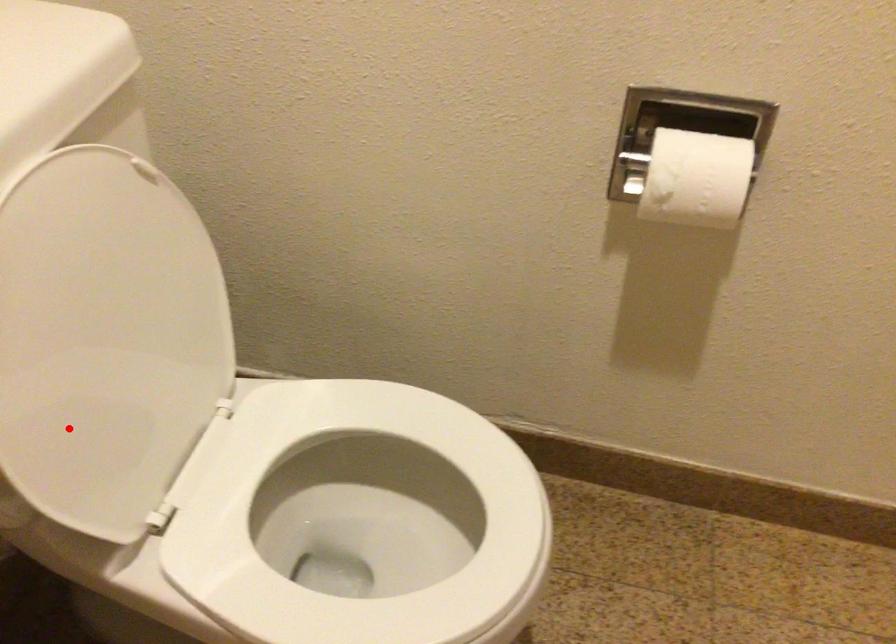
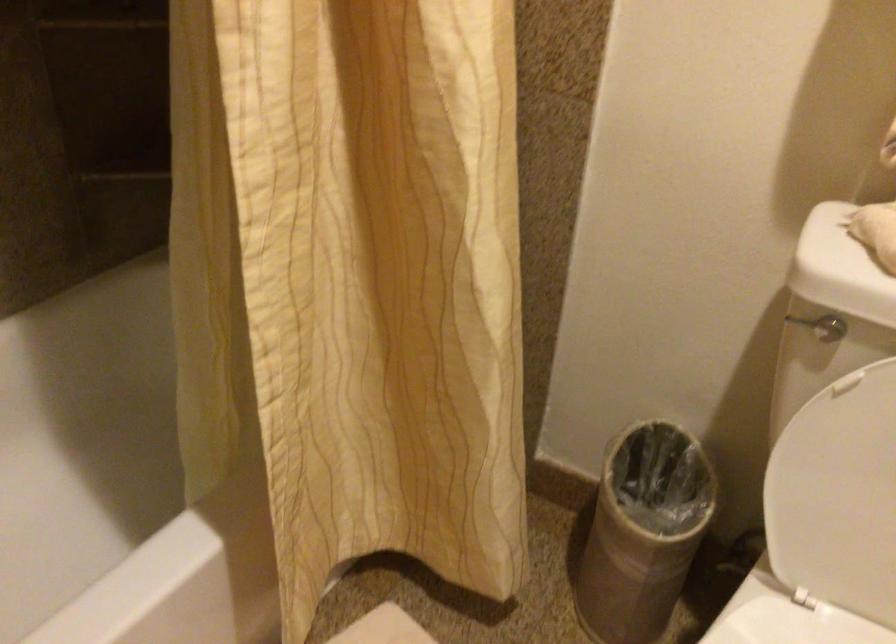
In the second image, find the point that corresponds to the highlighted location in the first image.

(834, 480)